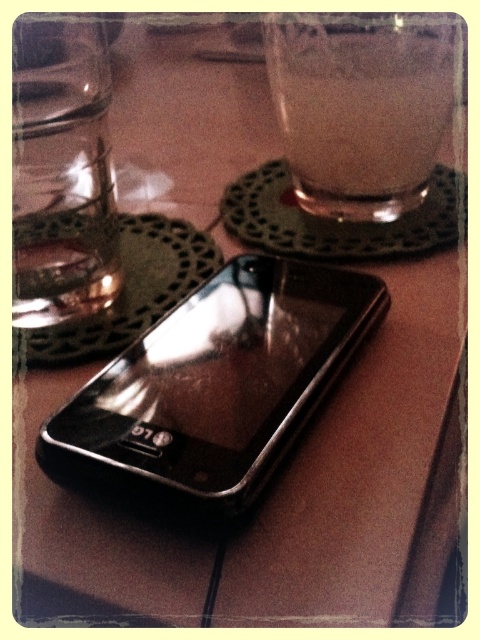
Does point (132, 371) come behind point (437, 45)?

No, (132, 371) is in front of (437, 45).

Can you confirm if black glossy smartphone at center is wider than transparent glass at upper center?

Indeed, black glossy smartphone at center has a greater width compared to transparent glass at upper center.

The height and width of the screenshot is (640, 480). Find the location of `black glossy smartphone at center`. black glossy smartphone at center is located at coordinates (220, 381).

Locate an element on the screen. This screenshot has height=640, width=480. black glossy smartphone at center is located at coordinates (220, 381).